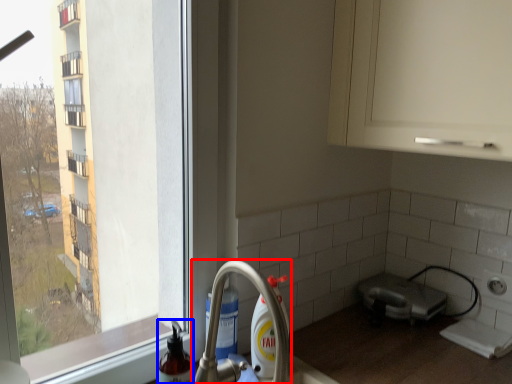
Question: Among these objects, which one is farthest to the camera, tap (highlighted by a red box) or cleaning product (highlighted by a blue box)?

Choices:
 (A) tap
 (B) cleaning product

Answer: (B)